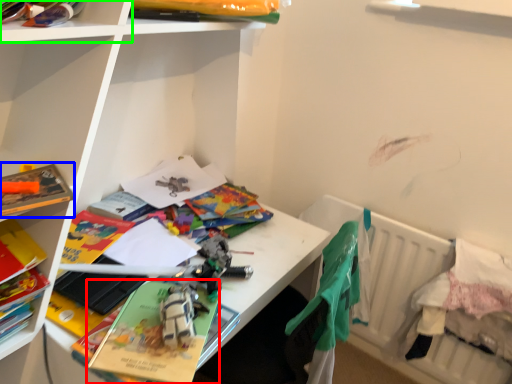
Question: Which object is positioned closest to paperback book (highlighted by a red box)? Select from paperback book (highlighted by a blue box) and shelf (highlighted by a green box).

Choices:
 (A) paperback book
 (B) shelf

Answer: (A)